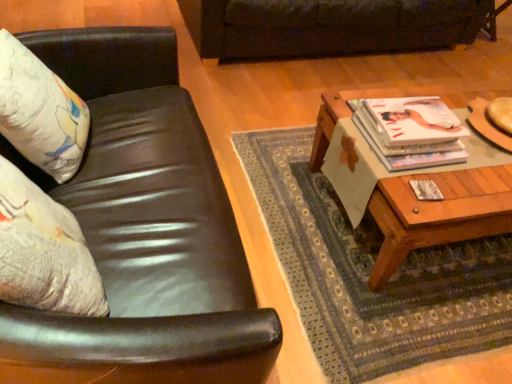
I want to click on unoccupied region to the right of black leather couch at left, the second studio couch positioned from the back, so click(332, 284).